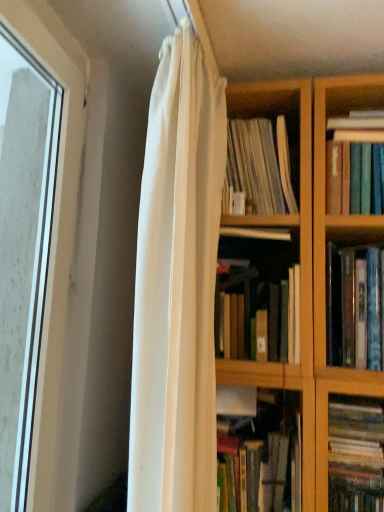
Question: Are hardcover books at right, which is the third book from top to bottom, and clear glass window at left far apart?

Choices:
 (A) no
 (B) yes

Answer: (A)

Question: Can you confirm if hardcover books at right, placed as the 3th book when sorted from bottom to top, is taller than clear glass window at left?

Choices:
 (A) yes
 (B) no

Answer: (B)

Question: Does hardcover books at right, which is the third book from top to bottom, have a larger size compared to clear glass window at left?

Choices:
 (A) no
 (B) yes

Answer: (A)

Question: Considering the relative positions of hardcover books at right, placed as the 3th book when sorted from bottom to top, and clear glass window at left in the image provided, is hardcover books at right, placed as the 3th book when sorted from bottom to top, to the right of clear glass window at left from the viewer's perspective?

Choices:
 (A) yes
 (B) no

Answer: (A)

Question: Is hardcover books at right, which is the third book from top to bottom, in front of clear glass window at left?

Choices:
 (A) yes
 (B) no

Answer: (B)

Question: Is multicolored paperbacks at right, arranged as the 5th book when viewed from the top, bigger or smaller than hardcover book at center, positioned as the 4th book in top-to-bottom order?

Choices:
 (A) big
 (B) small

Answer: (B)

Question: Is point (382, 507) positioned closer to the camera than point (240, 280)?

Choices:
 (A) farther
 (B) closer

Answer: (B)

Question: Is multicolored paperbacks at right, which is the first book in bottom-to-top order, taller or shorter than hardcover book at center, the 2th book ordered from the bottom?

Choices:
 (A) short
 (B) tall

Answer: (A)

Question: Is multicolored paperbacks at right, arranged as the 5th book when viewed from the top, wider or thinner than hardcover book at center, the 2th book ordered from the bottom?

Choices:
 (A) thin
 (B) wide

Answer: (B)

Question: Which is correct: white sheer curtain at center is inside white paper at center, the fourth book when ordered from bottom to top, or outside of it?

Choices:
 (A) outside
 (B) inside

Answer: (A)

Question: In the image, is white sheer curtain at center on the left side or the right side of white paper at center, the fourth book when ordered from bottom to top?

Choices:
 (A) left
 (B) right

Answer: (A)

Question: Is point (170, 282) positioned closer to the camera than point (258, 189)?

Choices:
 (A) closer
 (B) farther

Answer: (A)

Question: In the image, is white sheer curtain at center positioned in front of or behind white paper at center, the fourth book when ordered from bottom to top?

Choices:
 (A) front
 (B) behind

Answer: (A)

Question: From the image's perspective, is multicolored paperbacks at right, arranged as the 5th book when viewed from the top, positioned above or below white sheer curtain at center?

Choices:
 (A) above
 (B) below

Answer: (B)

Question: Looking at their shapes, would you say multicolored paperbacks at right, which is the first book in bottom-to-top order, is wider or thinner than white sheer curtain at center?

Choices:
 (A) thin
 (B) wide

Answer: (B)